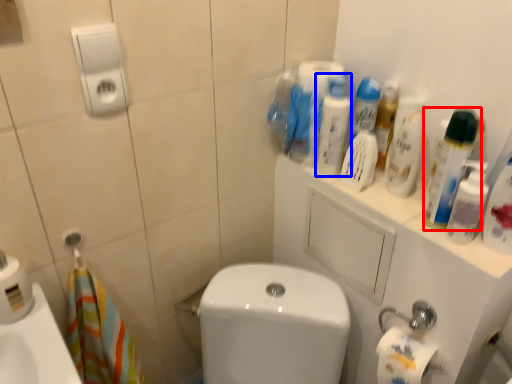
Question: Which point is closer to the camera, cleaning product (highlighted by a red box) or cleaning product (highlighted by a blue box)?

Choices:
 (A) cleaning product
 (B) cleaning product

Answer: (A)